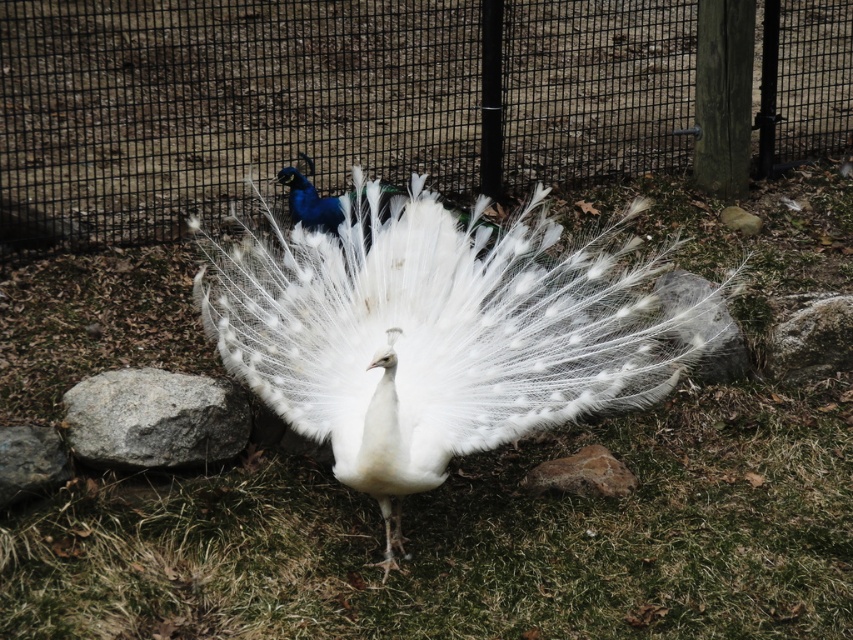
You are a zookeeper who wants to place a small food bowl for the white peacock. The bowl requires a flat surface that is at least 10 feet away from the camera to avoid disturbing the peacock. Is the gray rough rock at lower left a suitable surface for placing the bowl?

The gray rough rock at lower left is 12.17 feet away from the camera, which meets the requirement of being at least 10 feet away. Therefore, it is a suitable surface for placing the food bowl.